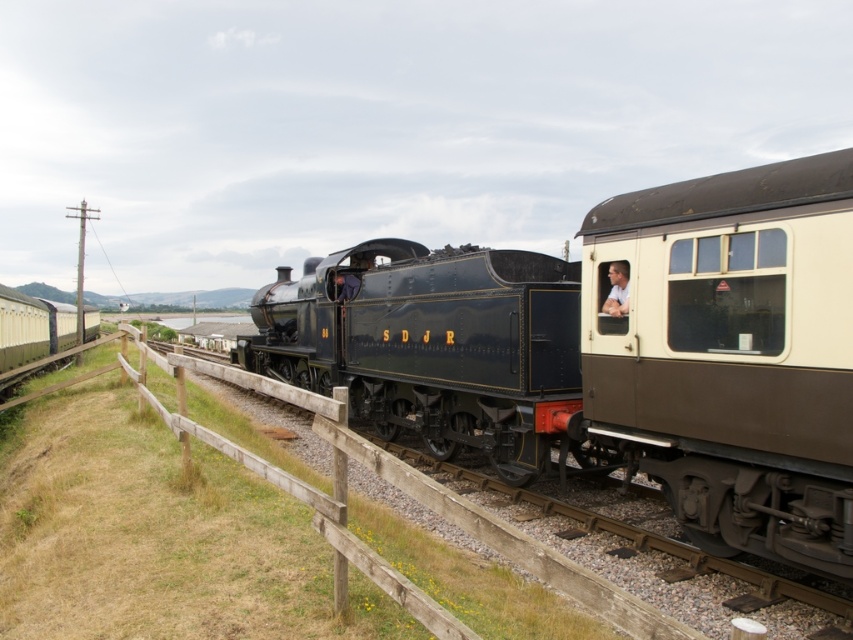
Does matte black locomotive at center lie in front of light blue shirt at center?

No, it is not.

Looking at this image, does matte black locomotive at center come behind light blue shirt at center?

Yes.

Which is behind, point (459, 404) or point (610, 308)?

Positioned behind is point (459, 404).

Where is `matte black locomotive at center`? Image resolution: width=853 pixels, height=640 pixels. matte black locomotive at center is located at coordinates (433, 346).

Can you confirm if polished dark blue locomotive at center is smaller than matte cream passenger car at right?

No, polished dark blue locomotive at center is not smaller than matte cream passenger car at right.

Is polished dark blue locomotive at center wider than matte cream passenger car at right?

Correct, the width of polished dark blue locomotive at center exceeds that of matte cream passenger car at right.

This screenshot has width=853, height=640. I want to click on polished dark blue locomotive at center, so click(x=622, y=349).

Find the location of a particular element. The width and height of the screenshot is (853, 640). polished dark blue locomotive at center is located at coordinates pos(622,349).

Is point (782, 324) closer to viewer compared to point (497, 273)?

Yes, point (782, 324) is in front of point (497, 273).

Is polished dark blue locomotive at center closer to camera compared to matte black locomotive at center?

Yes, polished dark blue locomotive at center is closer to the viewer.

Is point (506, 317) positioned in front of point (529, 436)?

No, (506, 317) is behind (529, 436).

What are the coordinates of `polished dark blue locomotive at center` in the screenshot? It's located at (622, 349).